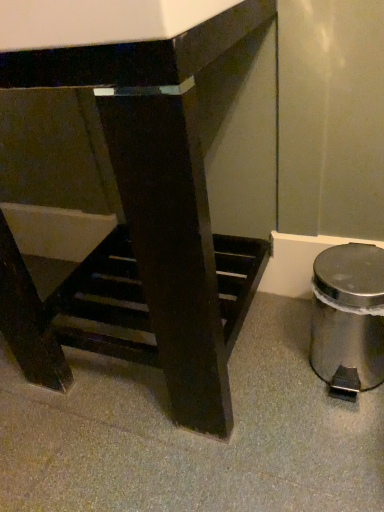
Question: Is polished stainless steel trash can at lower right taller than matte black table at center?

Choices:
 (A) yes
 (B) no

Answer: (B)

Question: Is matte black table at center at the back of polished stainless steel trash can at lower right?

Choices:
 (A) yes
 (B) no

Answer: (B)

Question: From the image's perspective, is polished stainless steel trash can at lower right on matte black table at center?

Choices:
 (A) yes
 (B) no

Answer: (B)

Question: Is polished stainless steel trash can at lower right positioned in front of matte black table at center?

Choices:
 (A) no
 (B) yes

Answer: (A)

Question: Is polished stainless steel trash can at lower right wider than matte black table at center?

Choices:
 (A) no
 (B) yes

Answer: (A)

Question: Is polished stainless steel trash can at lower right to the left of matte black table at center from the viewer's perspective?

Choices:
 (A) no
 (B) yes

Answer: (A)

Question: Is matte black table at center touching polished stainless steel trash can at lower right?

Choices:
 (A) no
 (B) yes

Answer: (A)

Question: From a real-world perspective, does matte black table at center sit lower than polished stainless steel trash can at lower right?

Choices:
 (A) yes
 (B) no

Answer: (B)

Question: Can polished stainless steel trash can at lower right be found inside matte black table at center?

Choices:
 (A) no
 (B) yes

Answer: (A)

Question: Is matte black table at center facing towards polished stainless steel trash can at lower right?

Choices:
 (A) no
 (B) yes

Answer: (A)

Question: From a real-world perspective, is matte black table at center physically above polished stainless steel trash can at lower right?

Choices:
 (A) no
 (B) yes

Answer: (B)

Question: Does matte black table at center have a lesser height compared to polished stainless steel trash can at lower right?

Choices:
 (A) yes
 (B) no

Answer: (B)

Question: Does point (322, 301) appear closer or farther from the camera than point (173, 257)?

Choices:
 (A) farther
 (B) closer

Answer: (A)